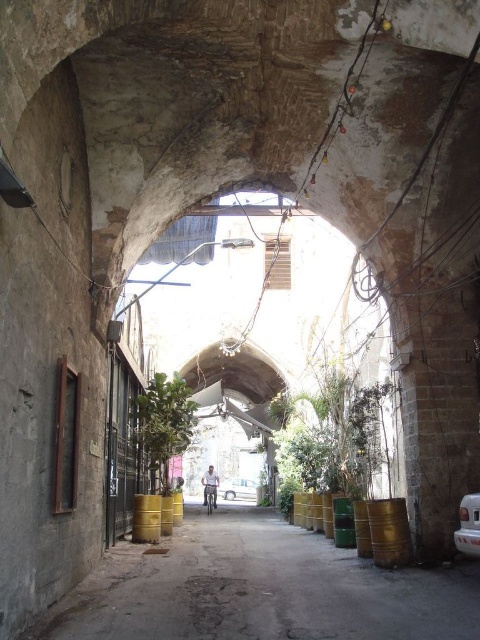
Where is `gold metallic barrel at right`? The width and height of the screenshot is (480, 640). gold metallic barrel at right is located at coordinates (388, 531).

Which is behind, point (383, 516) or point (233, 477)?

Positioned behind is point (233, 477).

The image size is (480, 640). What are the coordinates of `gold metallic barrel at right` in the screenshot? It's located at (388, 531).

Does white matte van at center have a lesser height compared to metallic silver car at center?

Correct, white matte van at center is not as tall as metallic silver car at center.

Does point (476, 529) come closer to viewer compared to point (242, 477)?

Yes, point (476, 529) is closer to viewer.

The width and height of the screenshot is (480, 640). Identify the location of white matte van at center. (468, 525).

Which is in front, point (236, 627) or point (144, 515)?

Point (236, 627) is more forward.

Does concrete alley at center appear under gold metallic barrel at center?

Indeed, concrete alley at center is positioned under gold metallic barrel at center.

What do you see at coordinates (262, 588) in the screenshot?
I see `concrete alley at center` at bounding box center [262, 588].

The image size is (480, 640). In order to click on concrete alley at center in this screenshot , I will do `click(262, 588)`.